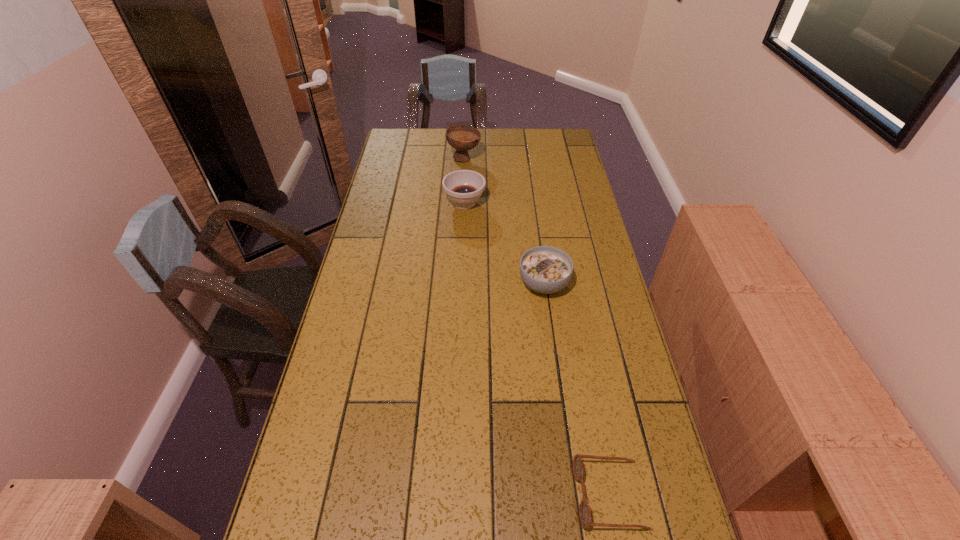
Locate an element on the screen. The image size is (960, 540). vacant space located 0.340m on the front-facing side of the shortest object is located at coordinates (420, 495).

At what (x,y) coordinates should I click in order to perform the action: click on free space located 0.240m on the front-facing side of the shortest object. Please return your answer as a coordinate pair (x, y). Looking at the image, I should click on (466, 495).

Locate an element on the screen. vacant space located 0.370m on the front-facing side of the shortest object is located at coordinates (406, 495).

You are a GUI agent. You are given a task and a screenshot of the screen. Output one action in this format:
    pyautogui.click(x=<x>, y=<y>)
    Task: Click on the object that is at the far edge
    The height and width of the screenshot is (540, 960).
    Given the screenshot: What is the action you would take?
    pyautogui.click(x=461, y=137)

Locate an element on the screen. Image resolution: width=960 pixels, height=540 pixels. soup bowl positioned at the right edge is located at coordinates (x=544, y=269).

Where is `spectacles at the right edge`? The width and height of the screenshot is (960, 540). spectacles at the right edge is located at coordinates (584, 508).

At what (x,y) coordinates should I click in order to perform the action: click on free space at the far edge of the desktop. Please return your answer as a coordinate pair (x, y). Image resolution: width=960 pixels, height=540 pixels. Looking at the image, I should click on pos(495,140).

In the image, there is a desktop. What are the coordinates of `vacant space at the left edge` in the screenshot? It's located at point(378,249).

Where is `free spot at the right edge of the desktop`? free spot at the right edge of the desktop is located at coordinates (597, 357).

Locate an element on the screen. Image resolution: width=960 pixels, height=540 pixels. vacant point at the far left corner is located at coordinates (394, 154).